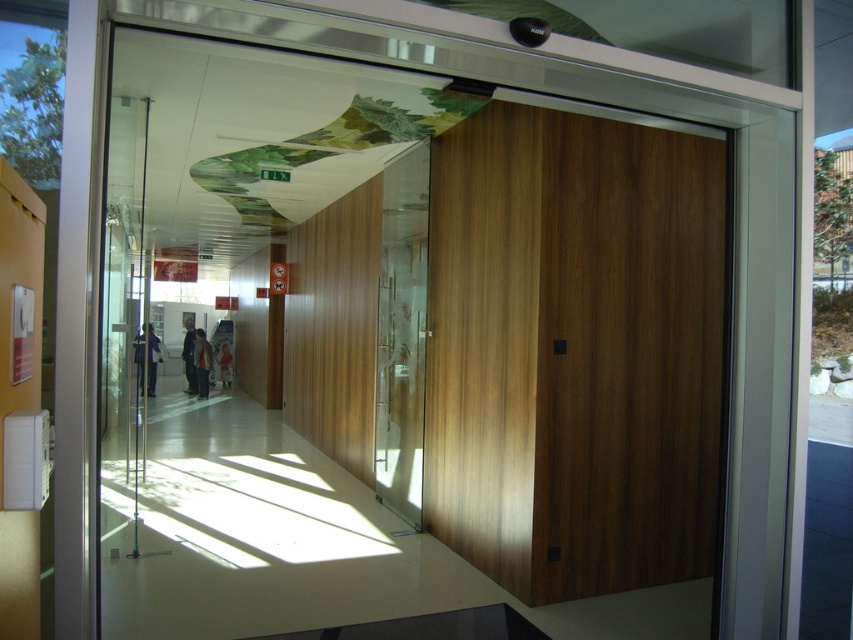
You are standing in the hallway and want to move from point A to point B. Point A is at coordinates point (158,358) and point B is at coordinates point (204,387). Which point is closer to you?

Point (204,387) is closer to you because point (158,358) is behind it.

You are standing in the hallway and see two points marked on the wall. Which point is closer to you, point (194, 369) or point (195, 381)?

Point (194, 369) is closer to you because it is further to the viewer than point (195, 381).

Looking at this image, you are standing in the hallway and see a dark brown leather jacket at center and a dark blue jeans at center. Which item is located to the right of the other?

The dark brown leather jacket at center is positioned on the right side of dark blue jeans at center.